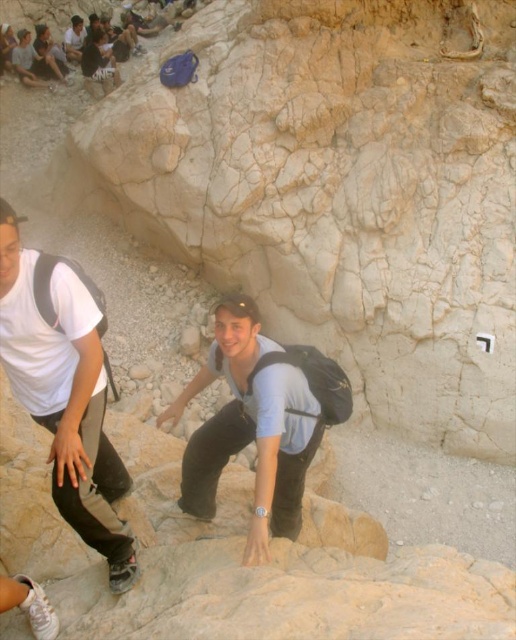
Which is behind, point (36, 294) or point (269, 492)?

The point (269, 492) is more distant.

This screenshot has height=640, width=516. Describe the element at coordinates (64, 388) in the screenshot. I see `white matte shirt at upper left` at that location.

From the picture: Who is more distant from viewer, [40,323] or [285,458]?

The point [285,458] is more distant.

Identify the location of white matte shirt at upper left. (64, 388).